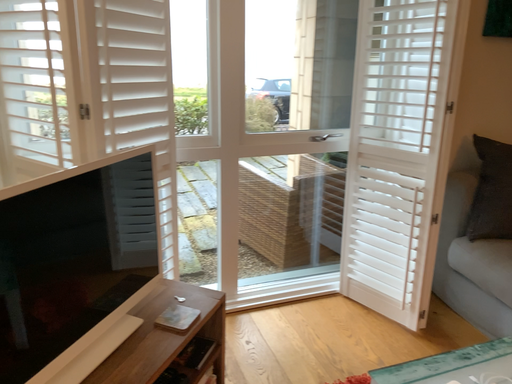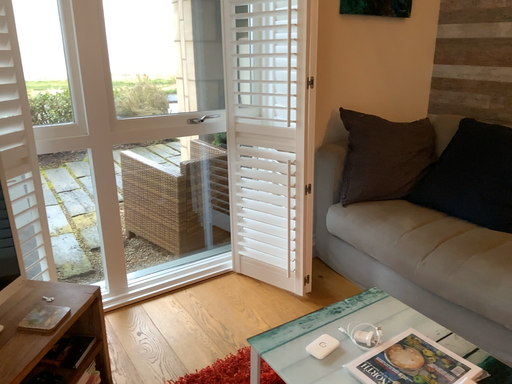
Question: Which way did the camera rotate in the video?

Choices:
 (A) rotated left
 (B) rotated right

Answer: (B)